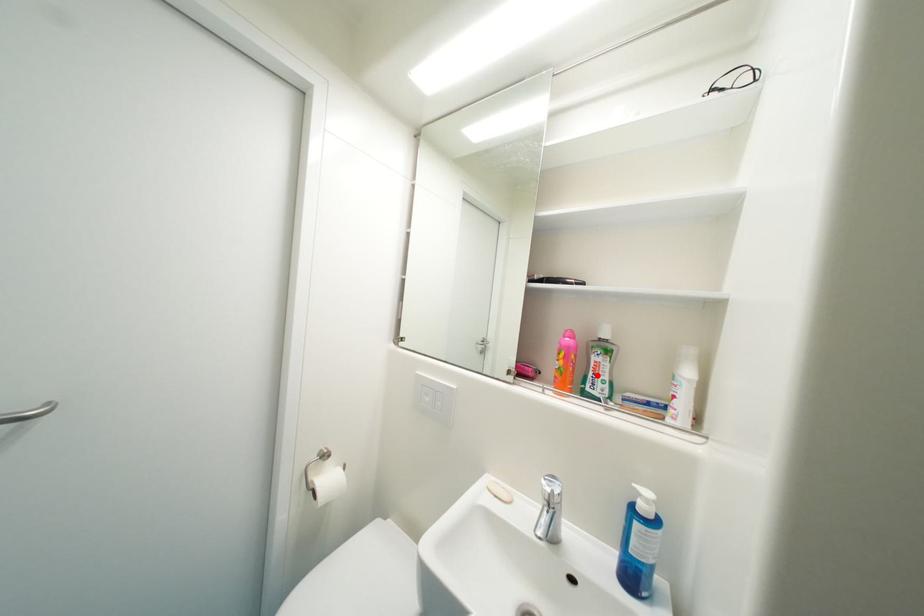
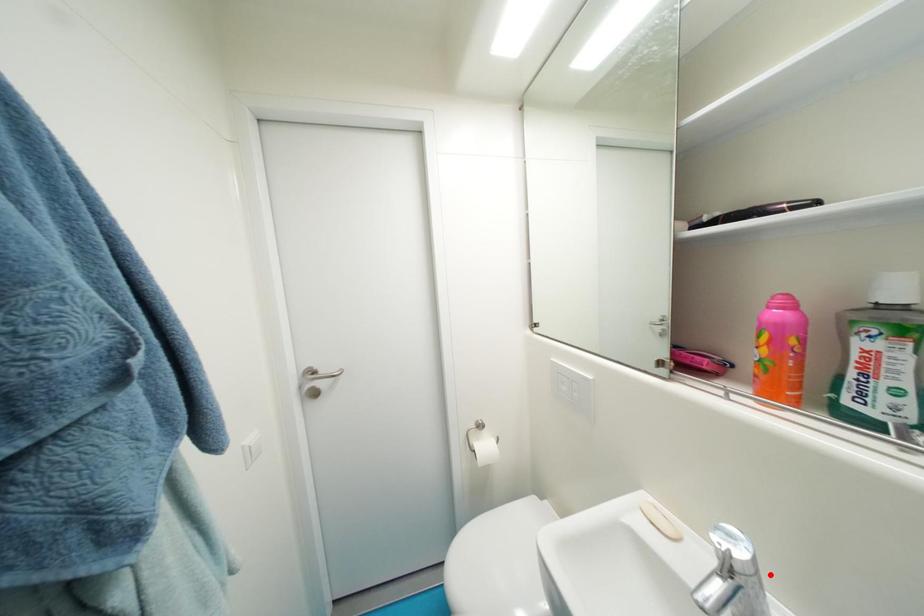
I am providing you with two images of the same scene from different viewpoints. A red point is marked on the first image and another point is marked on the second image. Are the points marked in image1 and image2 representing the same 3D position?

No